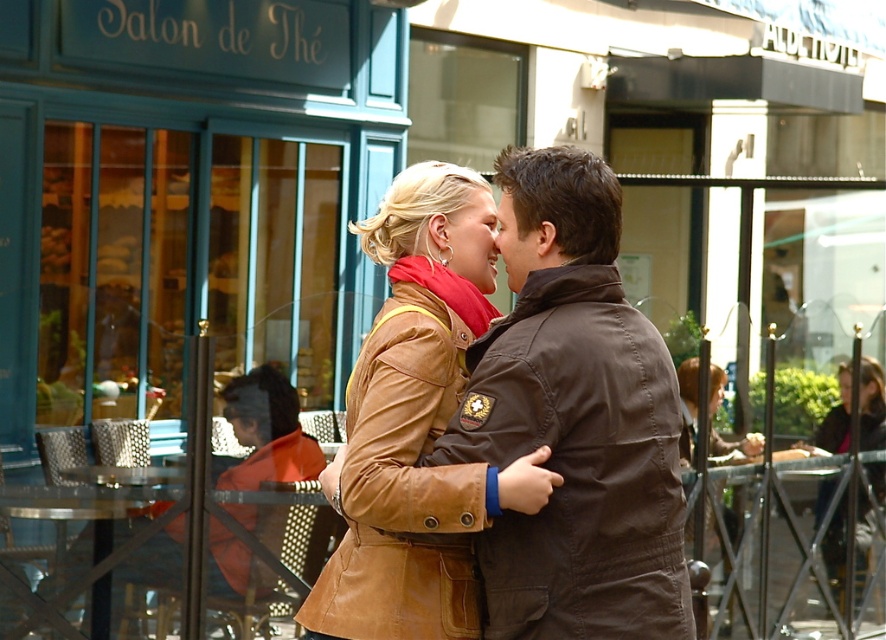
Question: Among these points, which one is farthest from the camera?

Choices:
 (A) coord(307,445)
 (B) coord(434,547)
 (C) coord(821,556)

Answer: (C)

Question: Is brown leather jacket at center to the left of dark brown leather jacket at lower right from the viewer's perspective?

Choices:
 (A) no
 (B) yes

Answer: (B)

Question: Which point is farther from the camera taking this photo?

Choices:
 (A) (228, 550)
 (B) (842, 426)

Answer: (B)

Question: Can you confirm if orange leather jacket at lower left is smaller than dark brown leather jacket at lower right?

Choices:
 (A) yes
 (B) no

Answer: (A)

Question: Does brown leather jacket at center have a smaller size compared to dark brown leather jacket at lower right?

Choices:
 (A) no
 (B) yes

Answer: (B)

Question: Which point is closer to the camera?

Choices:
 (A) (496, 536)
 (B) (246, 413)
 (C) (848, 410)

Answer: (A)